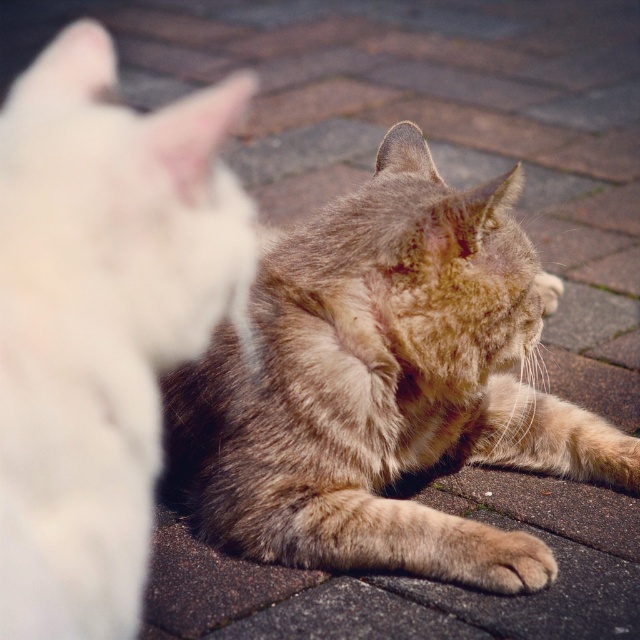
You are a photographer trying to capture both cats in focus. Since the tabby fur cat at center and the soft fur paw at lower center are at different distances, which one should you focus on to ensure the foreground cat is sharp?

You should focus on the tabby fur cat at center because it is in front of the soft fur paw at lower center, making it the foreground subject.

You are standing on a paved patio with interlocking bricks. There is a ginger tabby cat grooming its paw in the foreground and a white cat at point (100, 323). Which cat is closer to you?

The ginger tabby cat in the foreground is closer to you than the fluffy white cat at center located at point (100, 323).

You are standing at the center of the paved surface where the two cats are located. There is a tabby fur cat at center marked by point (378, 376). If you want to throw a treat to the tabby fur cat at center, which direction should you aim relative to your position?

The tabby fur cat at center is located at point (378, 376), so you should aim towards that coordinate to reach it.